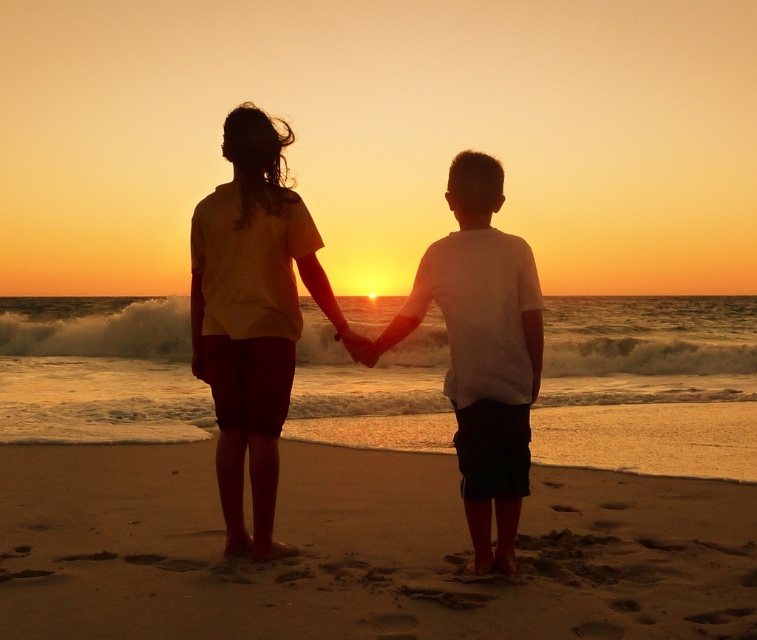
Question: Which point appears closest to the camera in this image?

Choices:
 (A) (447, 252)
 (B) (279, 300)
 (C) (621, 627)
 (D) (488, 163)

Answer: (C)

Question: From the image, what is the correct spatial relationship of matte yellow shirt at center in relation to white matte shirt at center?

Choices:
 (A) below
 (B) above

Answer: (B)

Question: Among these objects, which one is farthest from the camera?

Choices:
 (A) white matte shirt at center
 (B) matte yellow shirt at center
 (C) brown sandy beach at center

Answer: (C)

Question: Which of the following is the closest to the observer?

Choices:
 (A) (618, 522)
 (B) (226, 435)
 (C) (474, 550)
 (D) (444, 317)

Answer: (D)

Question: Can you confirm if brown sandy beach at center is positioned above white matte shirt at center?

Choices:
 (A) yes
 (B) no

Answer: (B)

Question: From the image, what is the correct spatial relationship of silhouette clothing at center in relation to matte yellow shirt at center?

Choices:
 (A) above
 (B) below

Answer: (B)